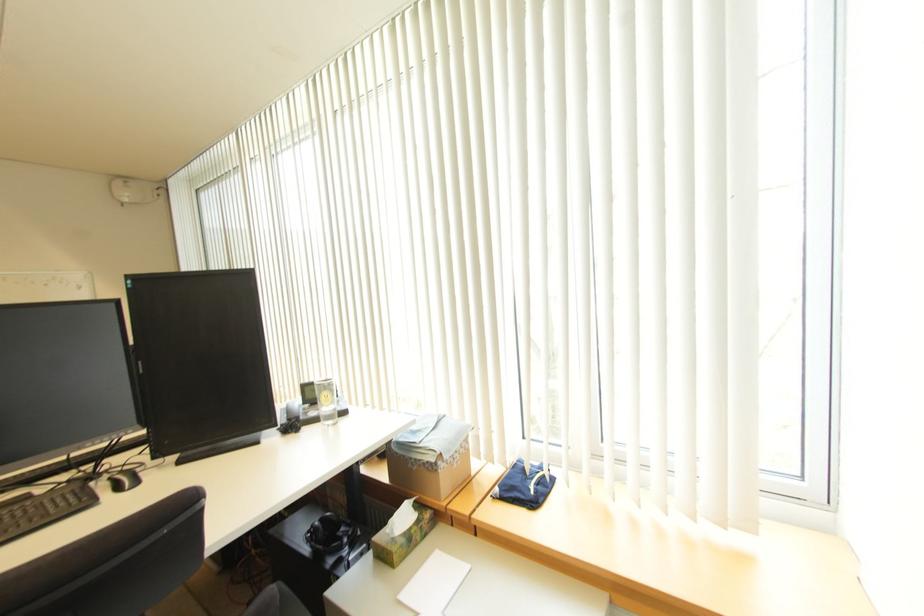
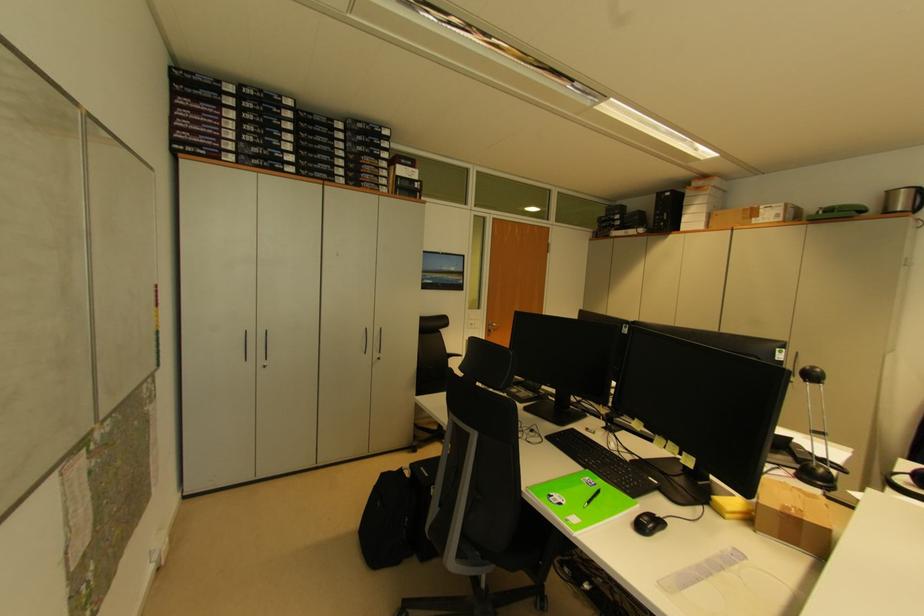
Question: How did the camera likely rotate?

Choices:
 (A) Left
 (B) Right
 (C) Up
 (D) Down

Answer: (A)